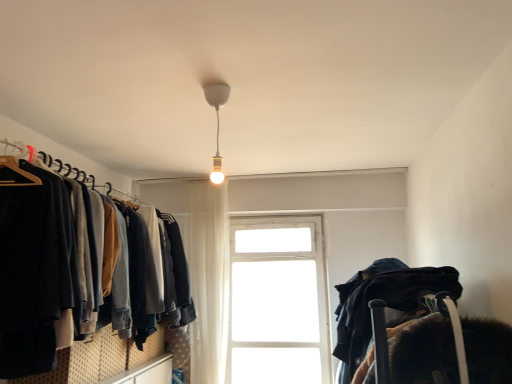
Question: Does dark blue sweater at left have a larger size compared to white sheer curtain at center?

Choices:
 (A) yes
 (B) no

Answer: (A)

Question: Can you confirm if dark blue sweater at left is positioned to the left of white sheer curtain at center?

Choices:
 (A) no
 (B) yes

Answer: (B)

Question: Are dark blue sweater at left and white sheer curtain at center far apart?

Choices:
 (A) no
 (B) yes

Answer: (B)

Question: From a real-world perspective, is dark blue sweater at left on white sheer curtain at center?

Choices:
 (A) yes
 (B) no

Answer: (A)

Question: Is dark blue sweater at left further to the viewer compared to white sheer curtain at center?

Choices:
 (A) yes
 (B) no

Answer: (B)

Question: Is point (225, 84) positioned closer to the camera than point (327, 324)?

Choices:
 (A) closer
 (B) farther

Answer: (A)

Question: Considering the relative positions of white matte bulb at center and white glass window at center in the image provided, is white matte bulb at center to the left or to the right of white glass window at center?

Choices:
 (A) left
 (B) right

Answer: (A)

Question: From their relative heights in the image, would you say white matte bulb at center is taller or shorter than white glass window at center?

Choices:
 (A) short
 (B) tall

Answer: (A)

Question: Is white matte bulb at center spatially inside white glass window at center, or outside of it?

Choices:
 (A) inside
 (B) outside

Answer: (B)

Question: In terms of height, does dark blue sweater at left look taller or shorter compared to white sheer curtain at center?

Choices:
 (A) short
 (B) tall

Answer: (A)

Question: Is dark blue sweater at left inside the boundaries of white sheer curtain at center, or outside?

Choices:
 (A) outside
 (B) inside

Answer: (A)

Question: In the image, is dark blue sweater at left positioned in front of or behind white sheer curtain at center?

Choices:
 (A) front
 (B) behind

Answer: (A)

Question: In terms of width, does dark blue sweater at left look wider or thinner when compared to white sheer curtain at center?

Choices:
 (A) thin
 (B) wide

Answer: (B)

Question: Is dark blue sweater at left wider or thinner than white matte bulb at center?

Choices:
 (A) thin
 (B) wide

Answer: (B)

Question: In terms of height, does dark blue sweater at left look taller or shorter compared to white matte bulb at center?

Choices:
 (A) tall
 (B) short

Answer: (A)